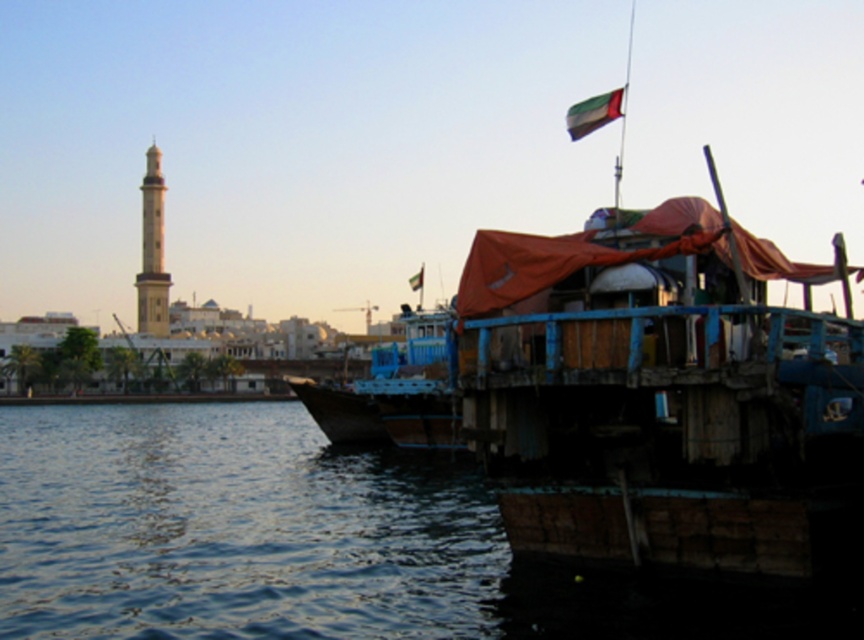
You are a sailor trying to identify which flag is bigger between the green fabric flag at upper right and the red fabric flag at upper right. Based on the scene, which one is larger?

The green fabric flag at upper right is larger in size than the red fabric flag at upper right.

You are a photographer standing at the waterfront scene. You notice the transparent water at lower left and the smooth beige tower at left. Which object is taller in the image?

The smooth beige tower at left is taller than the transparent water at lower left.

You are a photographer positioned at the pier and want to capture both the smooth beige tower at left and the red fabric flag at upper right in a single frame. Which object should you adjust your camera to focus on first to ensure both are in the shot?

You should focus on the smooth beige tower at left first since it is positioned to the left of the red fabric flag at upper right, allowing you to frame both objects by adjusting the camera to include both from left to right.